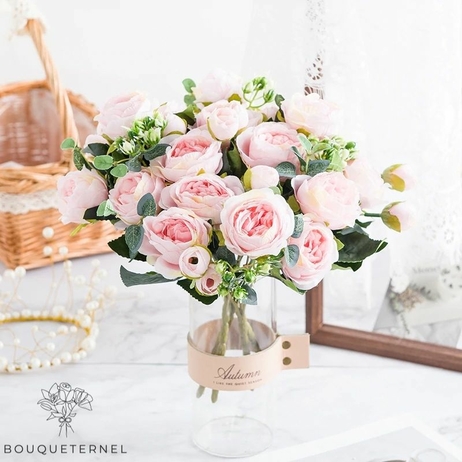
Identify the location of brown frame. (449, 358), (399, 348), (319, 330), (314, 306).